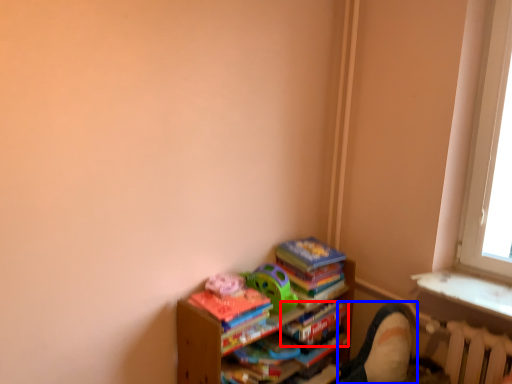
Question: Which point is further to the camera, paperback book (highlighted by a red box) or swivel chair (highlighted by a blue box)?

Choices:
 (A) paperback book
 (B) swivel chair

Answer: (A)